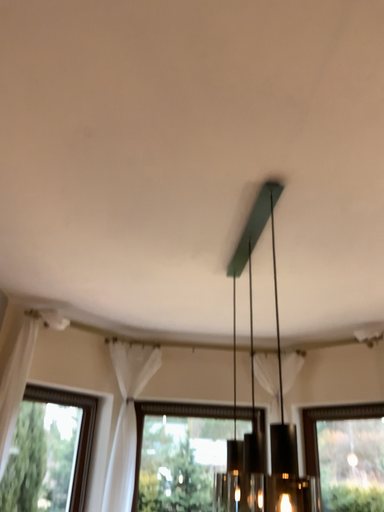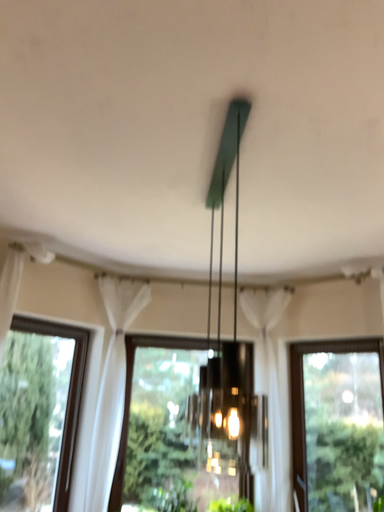
Question: How did the camera likely rotate when shooting the video?

Choices:
 (A) rotated downward
 (B) rotated upward

Answer: (A)